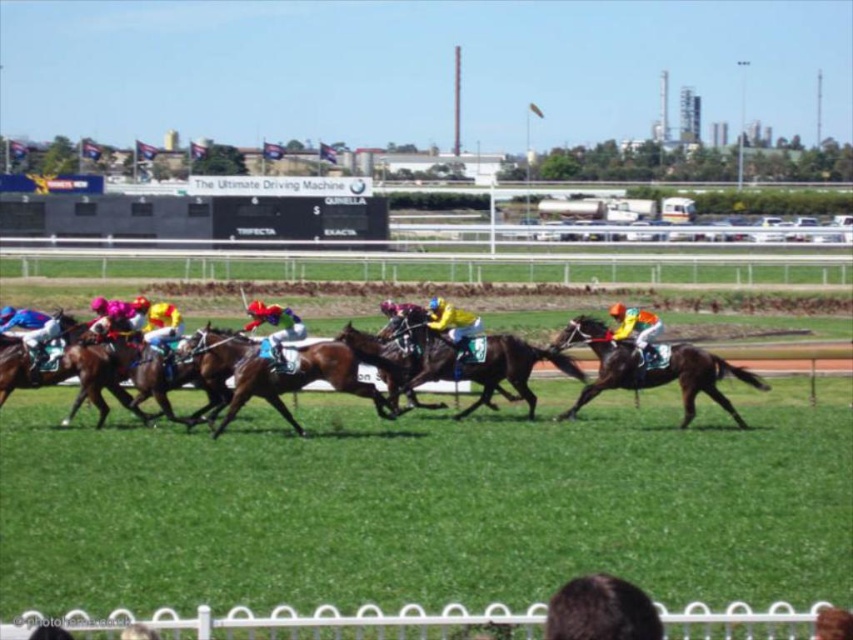
Question: Which object appears farthest from the camera in this image?

Choices:
 (A) black glossy horse at center
 (B) brown glossy horse at center
 (C) yellow fabric jockey at center

Answer: (C)

Question: Can you confirm if brown glossy horse at center is positioned above yellow fabric jockey at center?

Choices:
 (A) yes
 (B) no

Answer: (B)

Question: Does brown glossy horse at center have a greater width compared to yellow matte helmet at center?

Choices:
 (A) no
 (B) yes

Answer: (A)

Question: Is black glossy horse at center behind yellow matte helmet at center?

Choices:
 (A) no
 (B) yes

Answer: (A)

Question: Which point is closer to the camera?

Choices:
 (A) brown glossy horse at center
 (B) yellow matte helmet at center

Answer: (A)

Question: Which point is closer to the camera taking this photo?

Choices:
 (A) (648, 323)
 (B) (698, 369)

Answer: (B)